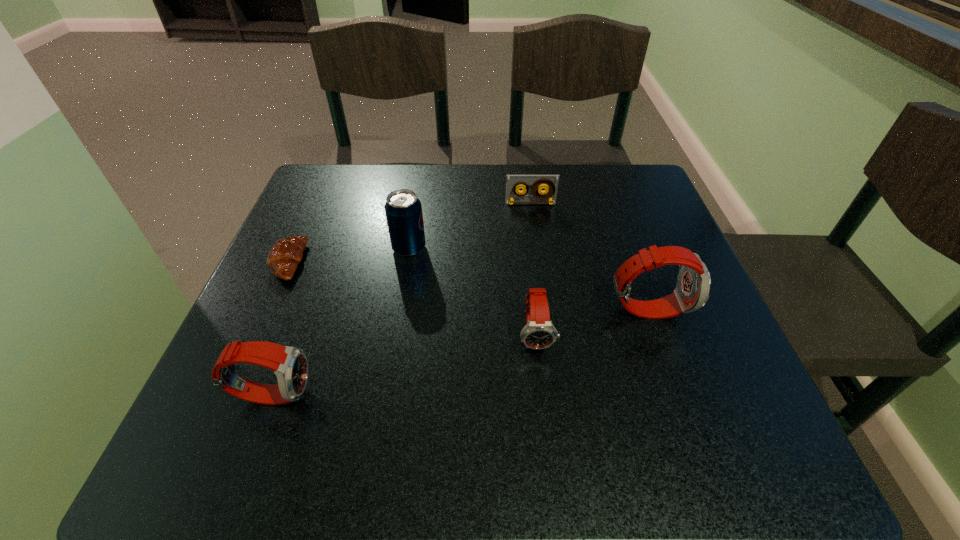
What are the coordinates of `the second closest watch relative to the fourth tallest object` in the screenshot? It's located at (290, 365).